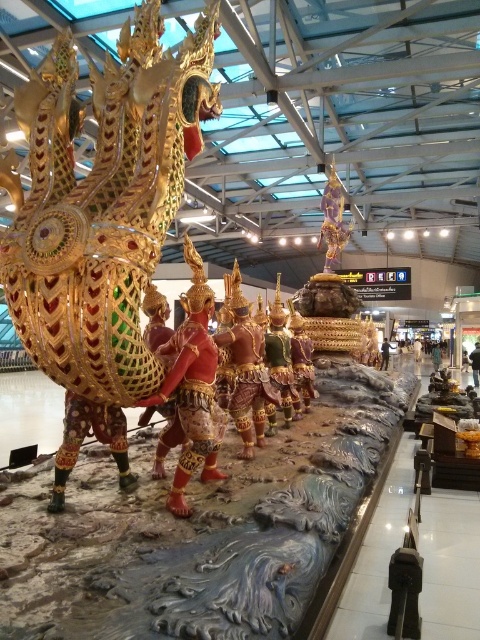
Which is above, gold textured statue at center or smooth gold statue at center?

gold textured statue at center is higher up.

Between gold textured statue at center and smooth gold statue at center, which one appears on the left side from the viewer's perspective?

gold textured statue at center is more to the left.

You are a GUI agent. You are given a task and a screenshot of the screen. Output one action in this format:
    pyautogui.click(x=<x>, y=<y>)
    Task: Click on the gold textured statue at center
    The height and width of the screenshot is (640, 480).
    Given the screenshot: What is the action you would take?
    pyautogui.click(x=247, y=369)

Is point (142, 204) behind point (479, 353)?

No, it is not.

Which is in front, point (40, 92) or point (468, 356)?

Positioned in front is point (40, 92).

Does point (107, 337) come closer to viewer compared to point (475, 362)?

Yes, point (107, 337) is in front of point (475, 362).

You are a GUI agent. You are given a task and a screenshot of the screen. Output one action in this format:
    pyautogui.click(x=<x>, y=<y>)
    Task: Click on the gold metallic dragon at center
    This screenshot has width=480, height=640.
    Given the screenshot: What is the action you would take?
    pyautogui.click(x=103, y=220)

Which is more to the right, gold metallic dragon at center or green fabric person at center?

Positioned to the right is green fabric person at center.

The width and height of the screenshot is (480, 640). What do you see at coordinates (103, 220) in the screenshot?
I see `gold metallic dragon at center` at bounding box center [103, 220].

Locate an element on the screen. gold metallic dragon at center is located at coordinates (103, 220).